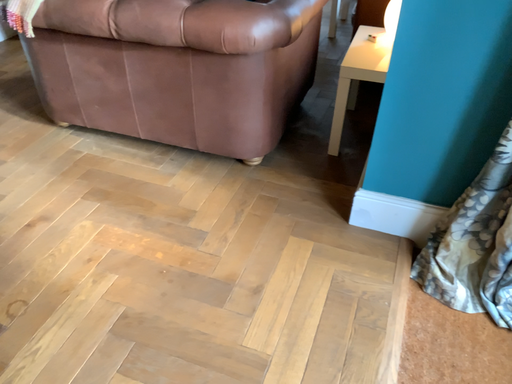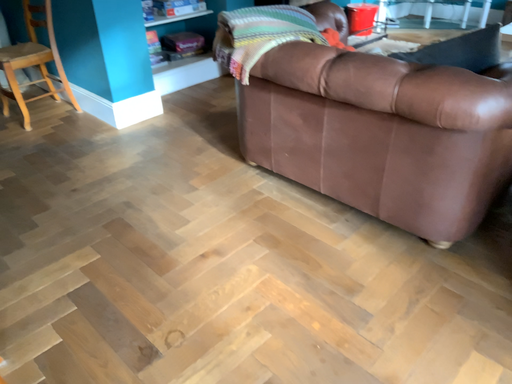
Question: Which way did the camera rotate in the video?

Choices:
 (A) rotated left
 (B) rotated right

Answer: (A)